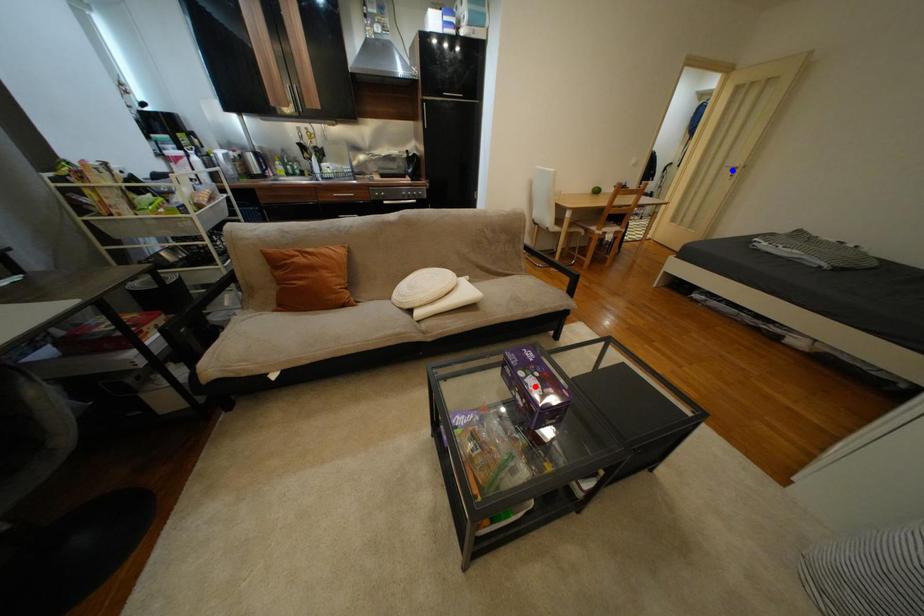
Question: In the image, two points are highlighted. Which point is nearer to the camera? Reply with the corresponding letter.

Choices:
 (A) blue point
 (B) red point

Answer: (B)